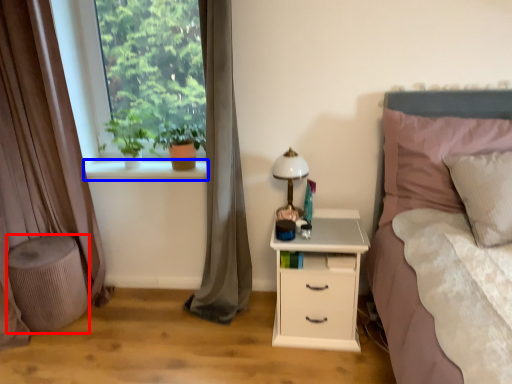
Question: Among these objects, which one is farthest to the camera, stool (highlighted by a red box) or window sill (highlighted by a blue box)?

Choices:
 (A) stool
 (B) window sill

Answer: (B)